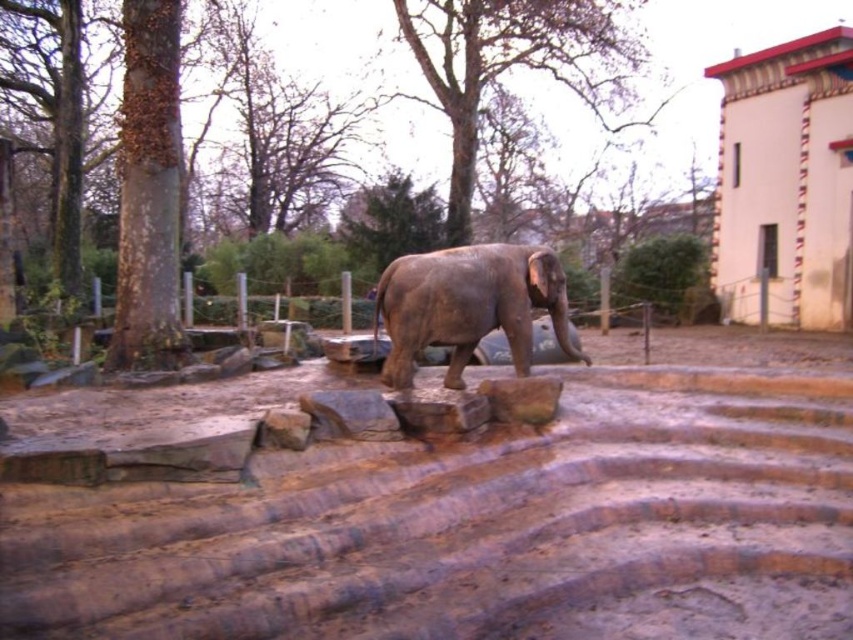
Question: Which point is farther to the camera?

Choices:
 (A) gray textured elephant at center
 (B) brown sandy dirt at center
 (C) white painted wall at upper right

Answer: (C)

Question: Estimate the real-world distances between objects in this image. Which object is farther from the white painted wall at upper right?

Choices:
 (A) gray textured elephant at center
 (B) brown sandy dirt at center

Answer: (B)

Question: Can you confirm if brown sandy dirt at center is wider than gray textured elephant at center?

Choices:
 (A) yes
 (B) no

Answer: (B)

Question: Which point appears closest to the camera in this image?

Choices:
 (A) (19, 518)
 (B) (717, 237)

Answer: (A)

Question: Can you confirm if brown sandy dirt at center is wider than white painted wall at upper right?

Choices:
 (A) yes
 (B) no

Answer: (B)

Question: Does white painted wall at upper right have a larger size compared to gray textured elephant at center?

Choices:
 (A) yes
 (B) no

Answer: (A)